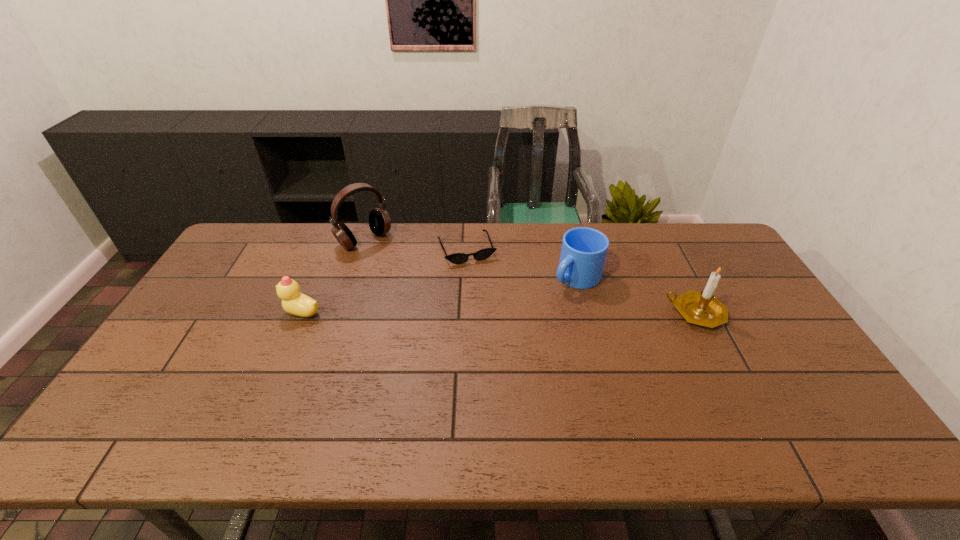
Locate an element on the screen. The height and width of the screenshot is (540, 960). free space located with a handle on the candle holder is located at coordinates (595, 313).

Image resolution: width=960 pixels, height=540 pixels. I want to click on vacant region located 0.130m with a handle on the candle holder, so click(623, 313).

I want to click on vacant space located 0.200m with a handle on the candle holder, so click(x=599, y=313).

Where is `vacant space situated 0.200m on the ear pads of the headset`? The height and width of the screenshot is (540, 960). vacant space situated 0.200m on the ear pads of the headset is located at coordinates (411, 282).

You are a GUI agent. You are given a task and a screenshot of the screen. Output one action in this format:
    pyautogui.click(x=<x>, y=<y>)
    Task: Click on the free space located 0.230m on the ear pads of the headset
    This screenshot has height=540, width=960.
    Given the screenshot: What is the action you would take?
    pyautogui.click(x=416, y=287)

In order to click on vacant space located on the ear pads of the headset in this screenshot , I will do `click(435, 303)`.

Locate an element on the screen. This screenshot has width=960, height=540. free space located on the side of the mug with the handle is located at coordinates (503, 336).

Locate an element on the screen. The image size is (960, 540). vacant space located 0.380m on the side of the mug with the handle is located at coordinates (475, 359).

Where is `vacant space situated on the side of the mug with the handle`? This screenshot has width=960, height=540. vacant space situated on the side of the mug with the handle is located at coordinates (480, 354).

Locate an element on the screen. This screenshot has height=540, width=960. free space located 0.130m on the front-facing side of the shortest object is located at coordinates (485, 292).